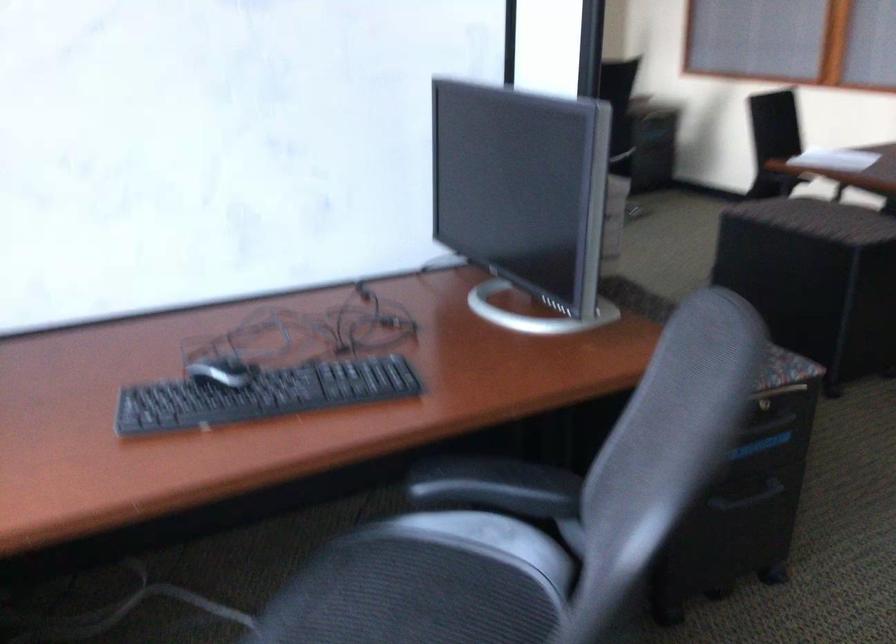
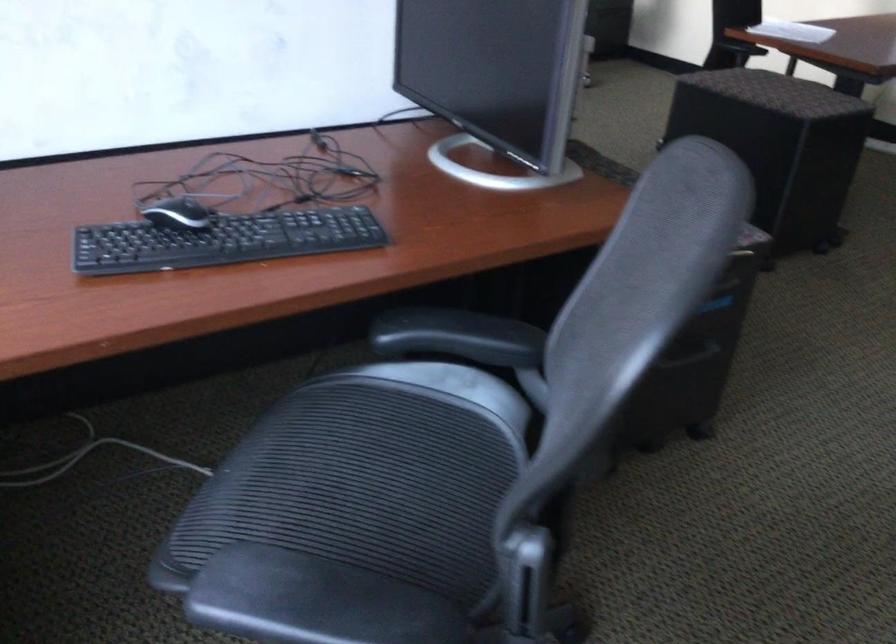
The point at (218, 372) is marked in the first image. Where is the corresponding point in the second image?

(177, 214)